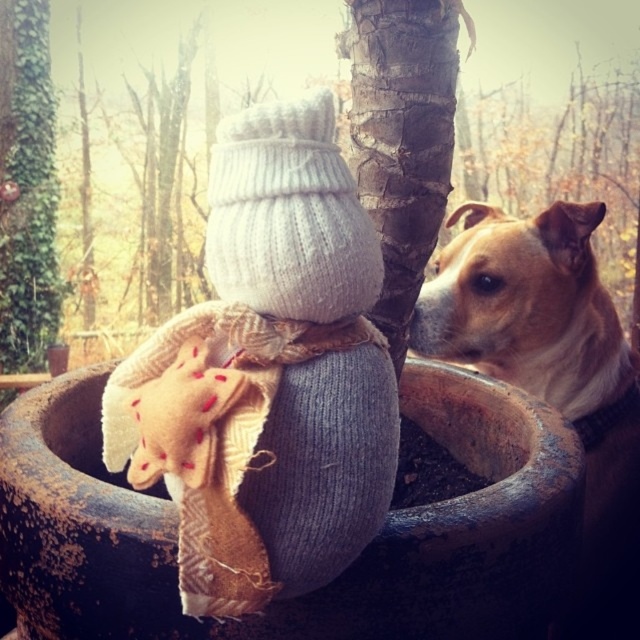
Question: From the image, what is the correct spatial relationship of smooth bark tree trunk at center in relation to green ivy at left?

Choices:
 (A) right
 (B) left

Answer: (A)

Question: Can you confirm if knitted woolen snowman at center is smaller than brown furry dog at right?

Choices:
 (A) yes
 (B) no

Answer: (A)

Question: Among these objects, which one is farthest from the camera?

Choices:
 (A) brown furry dog at right
 (B) smooth bark tree trunk at center
 (C) green ivy at left

Answer: (C)

Question: Is knitted woolen snowman at center positioned behind smooth bark tree trunk at center?

Choices:
 (A) yes
 (B) no

Answer: (B)

Question: Which point is closer to the camera?

Choices:
 (A) smooth bark tree trunk at center
 (B) brown furry dog at right

Answer: (A)

Question: Among these objects, which one is farthest from the camera?

Choices:
 (A) knitted woolen snowman at center
 (B) smooth bark tree trunk at center
 (C) green ivy at left

Answer: (C)